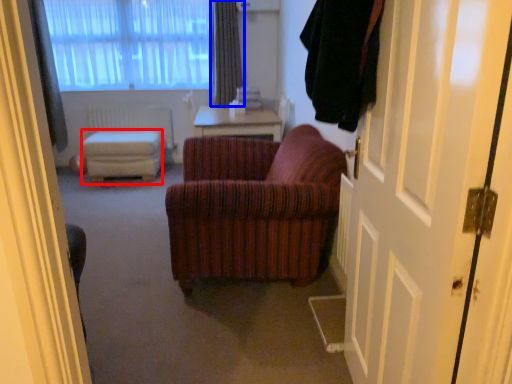
Question: Among these objects, which one is nearest to the camera, stool (highlighted by a red box) or curtain (highlighted by a blue box)?

Choices:
 (A) stool
 (B) curtain

Answer: (A)